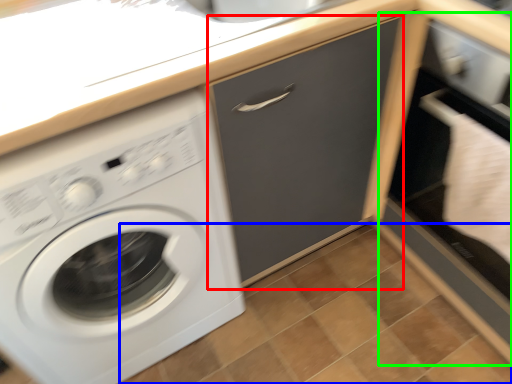
Question: Based on their relative distances, which object is nearer to drawer (highlighted by a red box)? Choose from tile (highlighted by a blue box) and file cabinet (highlighted by a green box).

Choices:
 (A) tile
 (B) file cabinet

Answer: (B)